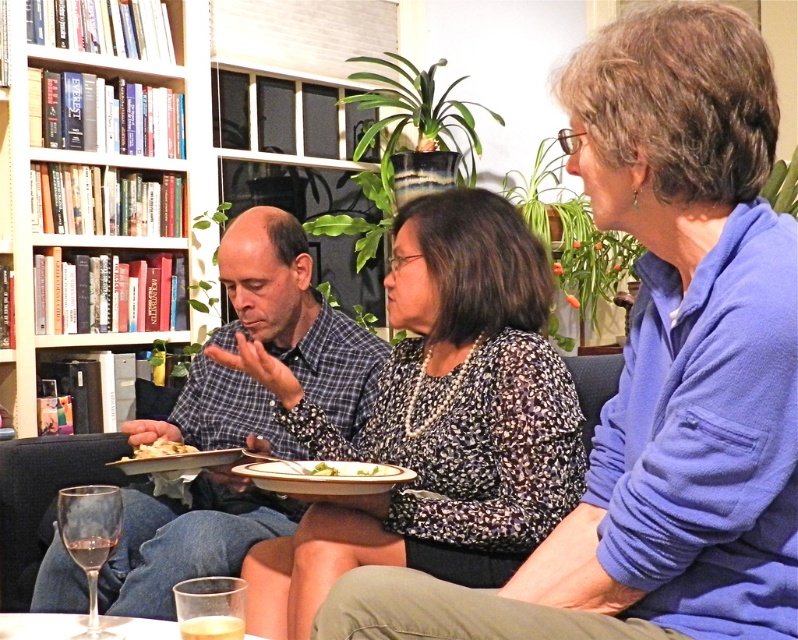
Does patterned fabric blouse at center have a lesser height compared to green leafy vegetable at center?

No.

Between patterned fabric blouse at center and green leafy vegetable at center, which one has more height?

Standing taller between the two is patterned fabric blouse at center.

This screenshot has width=798, height=640. Describe the element at coordinates (435, 419) in the screenshot. I see `patterned fabric blouse at center` at that location.

I want to click on patterned fabric blouse at center, so click(x=435, y=419).

Is point (251, 417) farther from camera compared to point (326, 467)?

That is True.

At what (x,y) coordinates should I click in order to perform the action: click on plaid shirt at center. Please return your answer as a coordinate pair (x, y). This screenshot has height=640, width=798. Looking at the image, I should click on (x=295, y=316).

Is patterned fabric blouse at center to the right of white matte plate at center from the viewer's perspective?

Correct, you'll find patterned fabric blouse at center to the right of white matte plate at center.

Can you confirm if patterned fabric blouse at center is thinner than white matte plate at center?

Incorrect, patterned fabric blouse at center's width is not less than white matte plate at center's.

Is point (285, 406) positioned in front of point (160, 452)?

Yes, point (285, 406) is closer to viewer.

The image size is (798, 640). What are the coordinates of `patterned fabric blouse at center` in the screenshot? It's located at (435, 419).